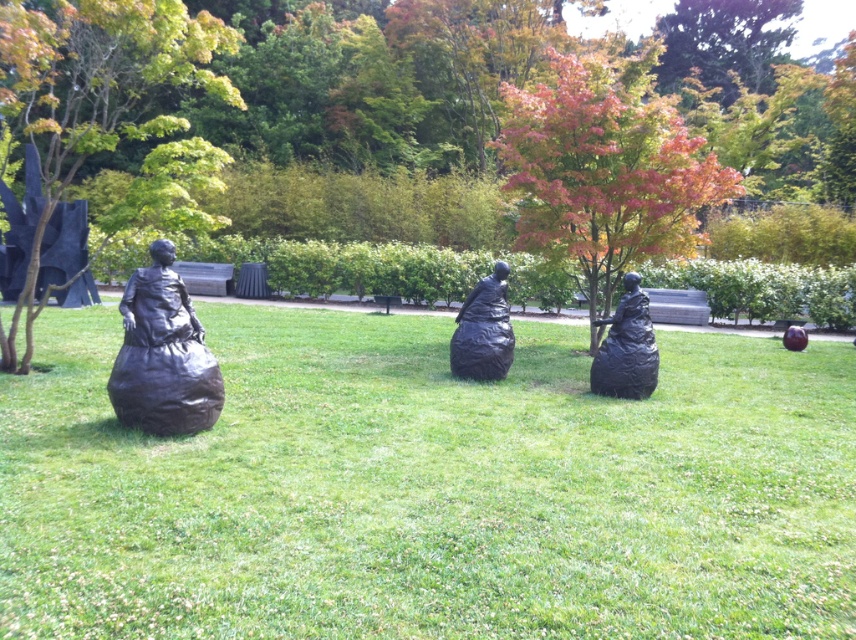
You are standing in the park and want to take a photo of the smooth brown tree at center. If you are currently 15 feet away from it, how many more feet do you need to move forward to reach the tree?

The smooth brown tree at center is 23.55 feet away from the viewer. If you are currently 15 feet away, you need to move forward 8.55 feet more to reach it.